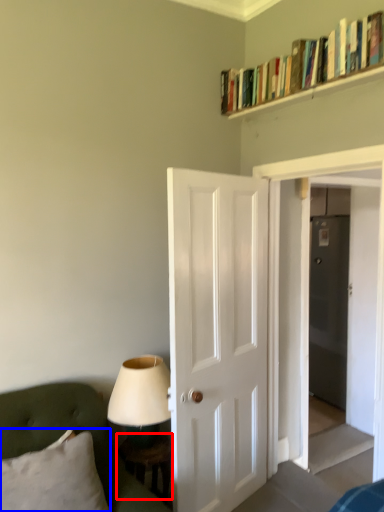
Question: Which object appears closest to the camera in this image, table (highlighted by a red box) or pillow (highlighted by a blue box)?

Choices:
 (A) table
 (B) pillow

Answer: (B)